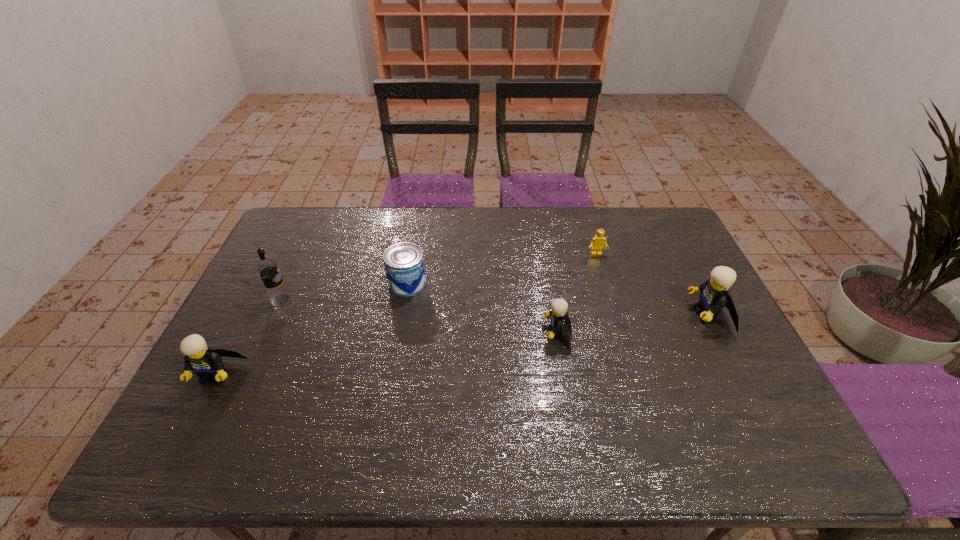
Locate an element on the screen. vodka located at the left edge is located at coordinates (268, 269).

Where is `object at the right edge`? The height and width of the screenshot is (540, 960). object at the right edge is located at coordinates (714, 296).

The height and width of the screenshot is (540, 960). I want to click on object situated at the near left corner, so click(206, 362).

This screenshot has width=960, height=540. I want to click on vacant space at the far edge, so click(x=590, y=209).

Identify the location of vacant area at the near edge. The width and height of the screenshot is (960, 540). (523, 402).

The image size is (960, 540). In the image, there is a desktop. In order to click on vacant space at the left edge in this screenshot , I will do (x=309, y=251).

At what (x,y) coordinates should I click in order to perform the action: click on vacant space at the right edge. Please return your answer as a coordinate pair (x, y). Looking at the image, I should click on (733, 362).

In order to click on free space at the far left corner of the desktop in this screenshot , I will do `click(304, 216)`.

The width and height of the screenshot is (960, 540). I want to click on blank space at the far right corner of the desktop, so click(666, 212).

Find the location of a particular element. The width and height of the screenshot is (960, 540). vacant point located between the vodka and the nearest Lego is located at coordinates (249, 338).